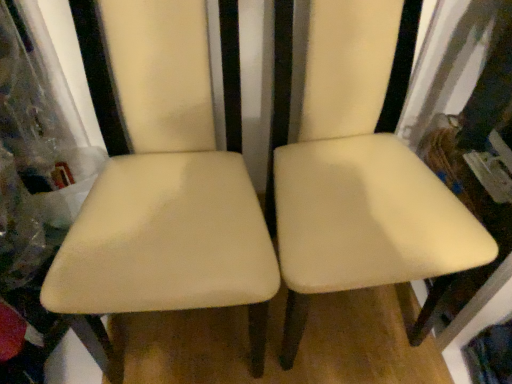
Question: Is point (442, 185) positioned closer to the camera than point (262, 221)?

Choices:
 (A) closer
 (B) farther

Answer: (B)

Question: In the image, is matte cream chair at center, the 2th chair when ordered from left to right, on the left side or the right side of beige leather chair at center, the 1th chair in the left-to-right sequence?

Choices:
 (A) right
 (B) left

Answer: (A)

Question: Is matte cream chair at center, the 2th chair when ordered from left to right, in front of or behind beige leather chair at center, positioned as the 2th chair in right-to-left order, in the image?

Choices:
 (A) front
 (B) behind

Answer: (B)

Question: Do you think beige leather chair at center, the 1th chair in the left-to-right sequence, is within matte cream chair at center, the 2th chair when ordered from left to right, or outside of it?

Choices:
 (A) inside
 (B) outside

Answer: (B)

Question: In terms of height, does beige leather chair at center, positioned as the 2th chair in right-to-left order, look taller or shorter compared to matte cream chair at center, which appears as the first chair when viewed from the right?

Choices:
 (A) tall
 (B) short

Answer: (B)

Question: Considering their positions, is beige leather chair at center, positioned as the 2th chair in right-to-left order, located in front of or behind matte cream chair at center, which appears as the first chair when viewed from the right?

Choices:
 (A) behind
 (B) front

Answer: (B)

Question: From a real-world perspective, is beige leather chair at center, the 1th chair in the left-to-right sequence, positioned above or below matte cream chair at center, the 2th chair when ordered from left to right?

Choices:
 (A) below
 (B) above

Answer: (B)